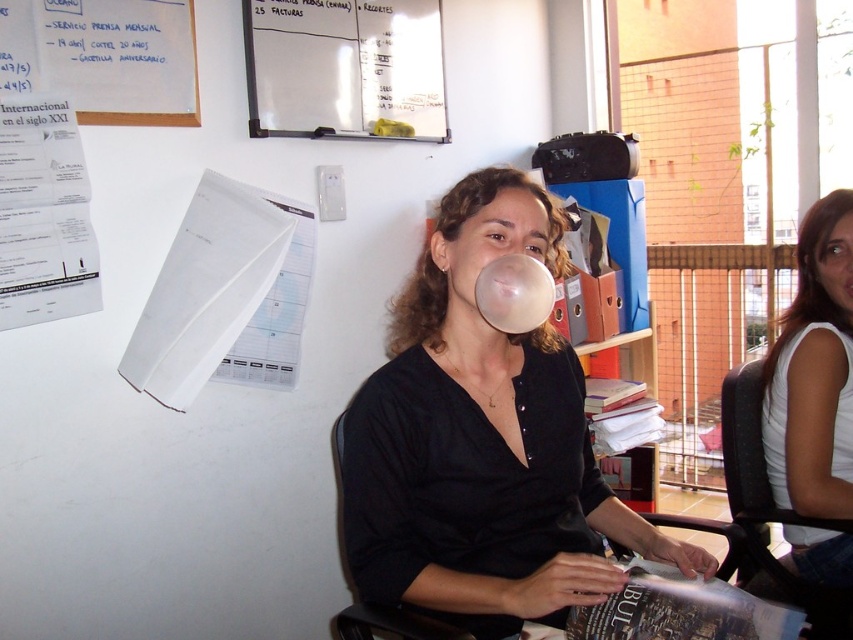
Question: Which object is farther from the camera taking this photo?

Choices:
 (A) black mesh swivel chair at right
 (B) whiteboard at upper center
 (C) black fabric chair at center

Answer: (B)

Question: Can you confirm if black mesh swivel chair at right is positioned to the right of black fabric chair at center?

Choices:
 (A) no
 (B) yes

Answer: (B)

Question: Considering the relative positions of white cotton tank top at right and white paper at upper left in the image provided, where is white cotton tank top at right located with respect to white paper at upper left?

Choices:
 (A) above
 (B) below

Answer: (B)

Question: Can you confirm if black mesh swivel chair at right is bigger than black fabric chair at center?

Choices:
 (A) yes
 (B) no

Answer: (B)

Question: Which object appears farthest from the camera in this image?

Choices:
 (A) white paper at upper left
 (B) black fabric chair at center
 (C) white cotton tank top at right
 (D) whiteboard at upper center

Answer: (D)

Question: Estimate the real-world distances between objects in this image. Which object is closer to the whiteboard at upper center?

Choices:
 (A) black fabric chair at center
 (B) matte black shirt at center

Answer: (B)